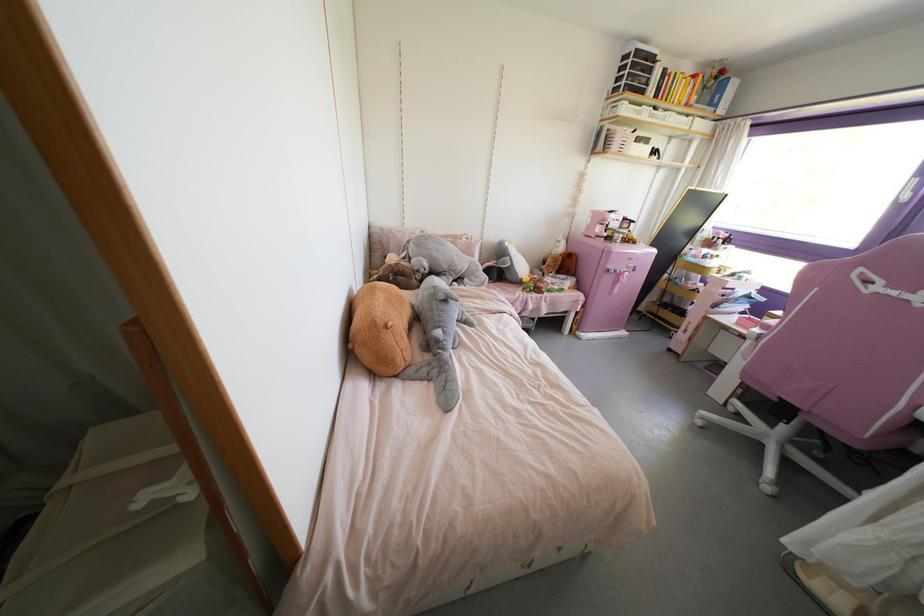
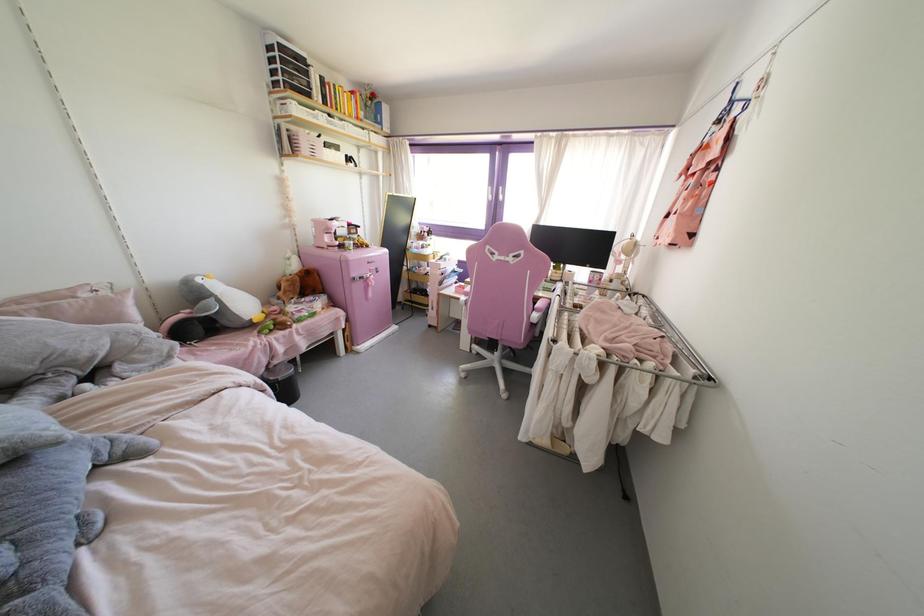
In the second image, find the point that corresponds to pixel 464 238 in the first image.

(83, 294)